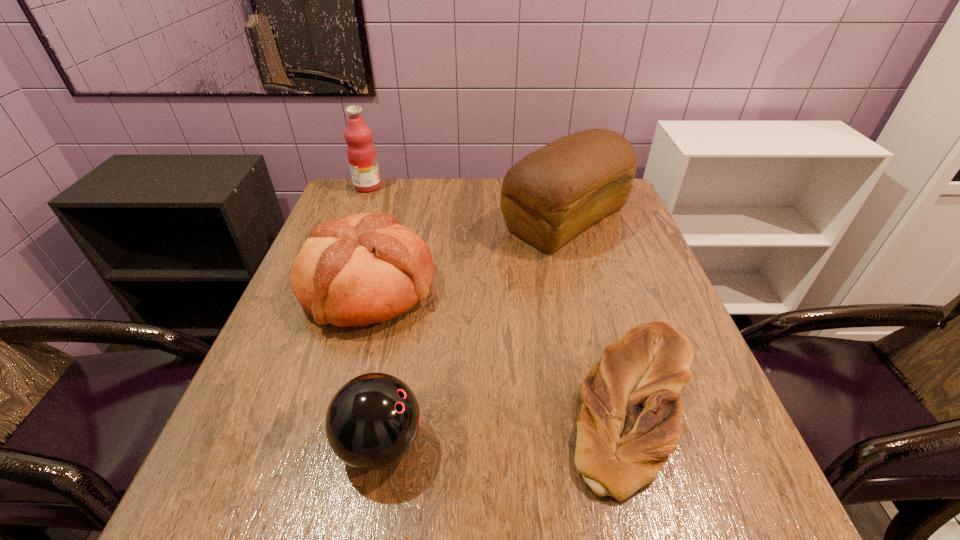
Identify the location of unoccupied position between the shortest bread and the bowling ball. (x=508, y=424).

Where is `vacant space that's between the tallest bread and the second shortest bread`? The image size is (960, 540). vacant space that's between the tallest bread and the second shortest bread is located at coordinates (467, 253).

Locate an element on the screen. The width and height of the screenshot is (960, 540). vacant area that lies between the fruit juice and the tallest bread is located at coordinates (467, 202).

This screenshot has width=960, height=540. In order to click on object that is the third closest one to the fruit juice in this screenshot , I will do `click(631, 418)`.

Find the location of a particular element. the second closest object relative to the bowling ball is located at coordinates (631, 418).

Where is `the second closest bread to the tallest bread`? the second closest bread to the tallest bread is located at coordinates (631, 418).

Locate which bread is the second closest to the second shortest bread. Please provide its 2D coordinates. Your answer should be formatted as a tuple, i.e. [(x, y)], where the tuple contains the x and y coordinates of a point satisfying the conditions above.

[(631, 418)]

Identify the location of free spot that satisfies the following two spatial constraints: 1. on the label of the fruit juice; 2. on the left side of the shortest object. (284, 405).

Find the location of `free location that satisfies the following two spatial constraints: 1. on the label of the tallest bread; 2. on the right side of the fruit juice`. free location that satisfies the following two spatial constraints: 1. on the label of the tallest bread; 2. on the right side of the fruit juice is located at coordinates (355, 219).

Locate an element on the screen. This screenshot has height=540, width=960. free location that satisfies the following two spatial constraints: 1. on the back side of the tallest bread; 2. on the label of the fruit juice is located at coordinates (557, 187).